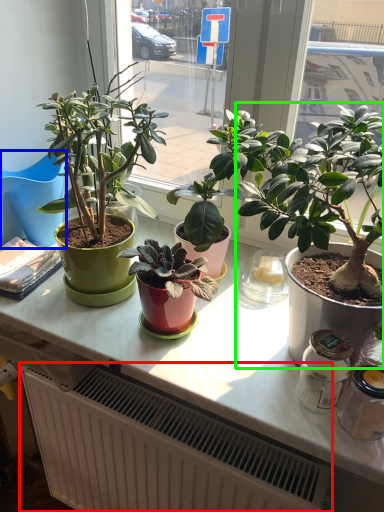
Question: Which object is the closest to the radiator (highlighted by a red box)? Choose among these: chair (highlighted by a blue box) or houseplant (highlighted by a green box).

Choices:
 (A) chair
 (B) houseplant

Answer: (B)